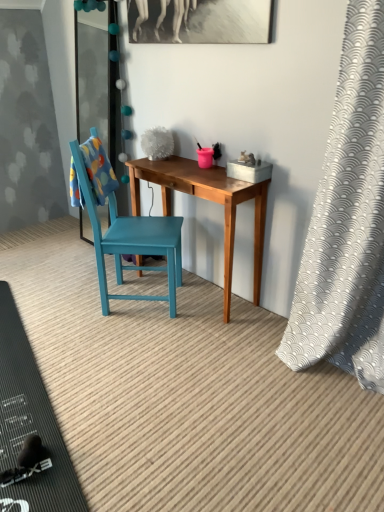
This screenshot has width=384, height=512. In order to click on empty space that is ontop of black rubber mat at lower left (from a real-world perspective) in this screenshot , I will do `click(20, 403)`.